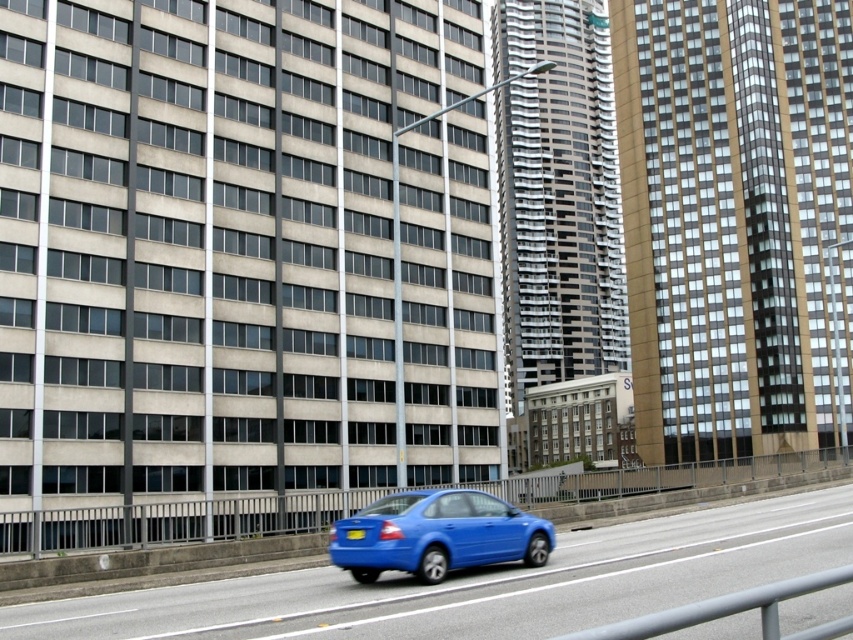
Question: Is the position of smooth asphalt highway at center more distant than that of glossy blue sedan at center?

Choices:
 (A) no
 (B) yes

Answer: (A)

Question: Which object is closer to the camera taking this photo?

Choices:
 (A) smooth asphalt highway at center
 (B) glossy blue sedan at center

Answer: (A)

Question: Which of the following is the farthest from the observer?

Choices:
 (A) glossy blue sedan at center
 (B) smooth asphalt highway at center

Answer: (A)

Question: Is smooth asphalt highway at center positioned at the back of glossy blue sedan at center?

Choices:
 (A) yes
 (B) no

Answer: (B)

Question: Is smooth asphalt highway at center positioned behind glossy blue sedan at center?

Choices:
 (A) no
 (B) yes

Answer: (A)